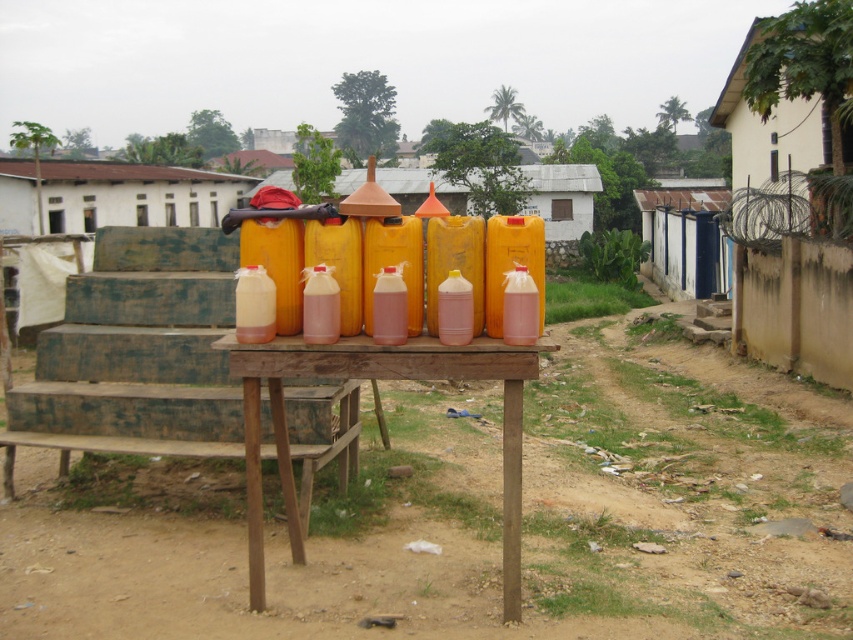
Which is more to the left, dirt field at lower center or wooden table at center?

Positioned to the left is dirt field at lower center.

Image resolution: width=853 pixels, height=640 pixels. I want to click on dirt field at lower center, so click(474, 515).